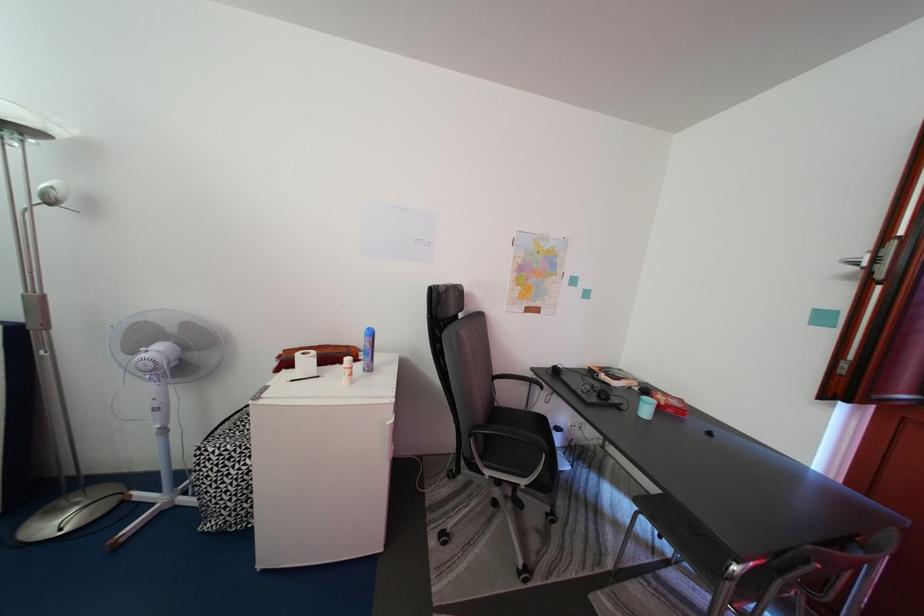
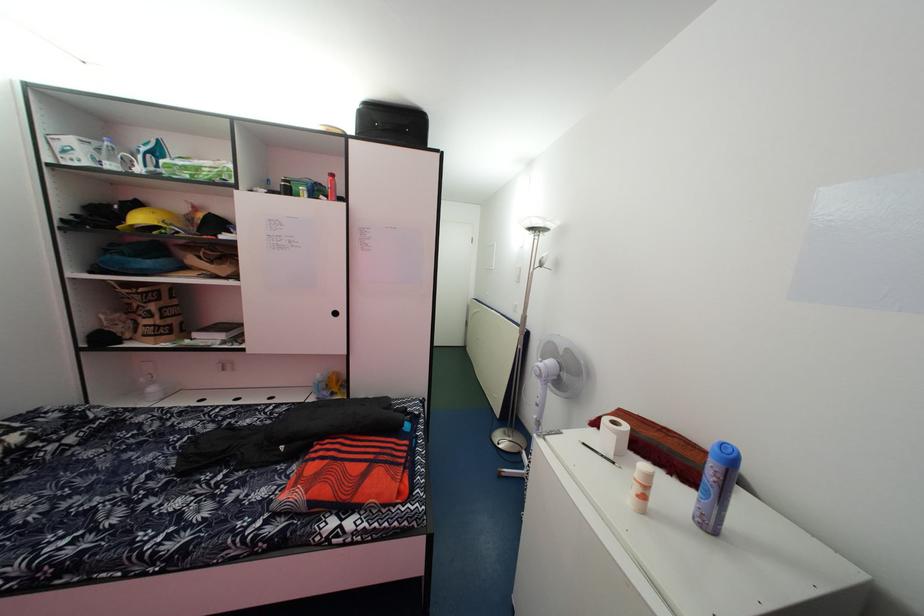
Question: Based on the continuous images, in which direction is the camera rotating? Reply with the corresponding letter.

Choices:
 (A) Left
 (B) Right
 (C) Up
 (D) Down

Answer: (A)